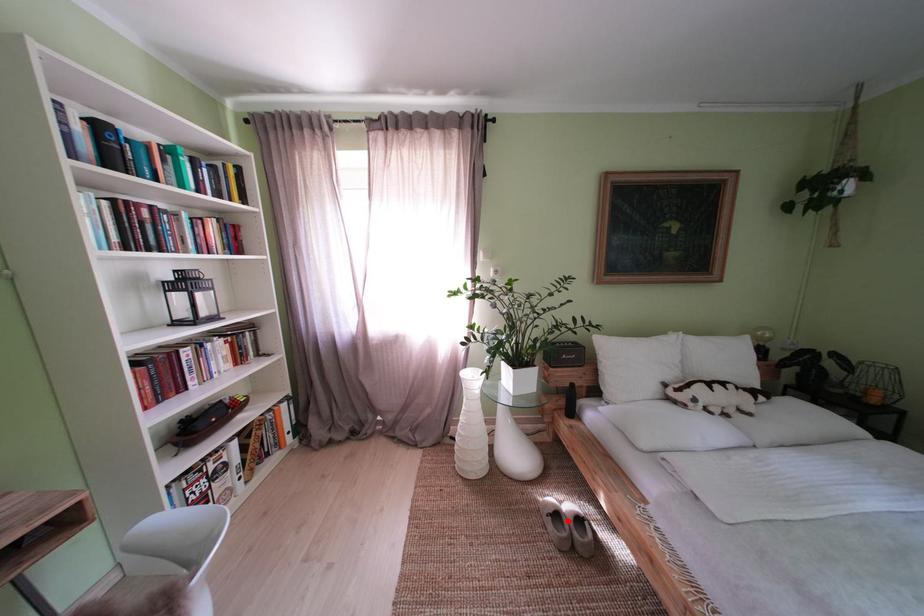
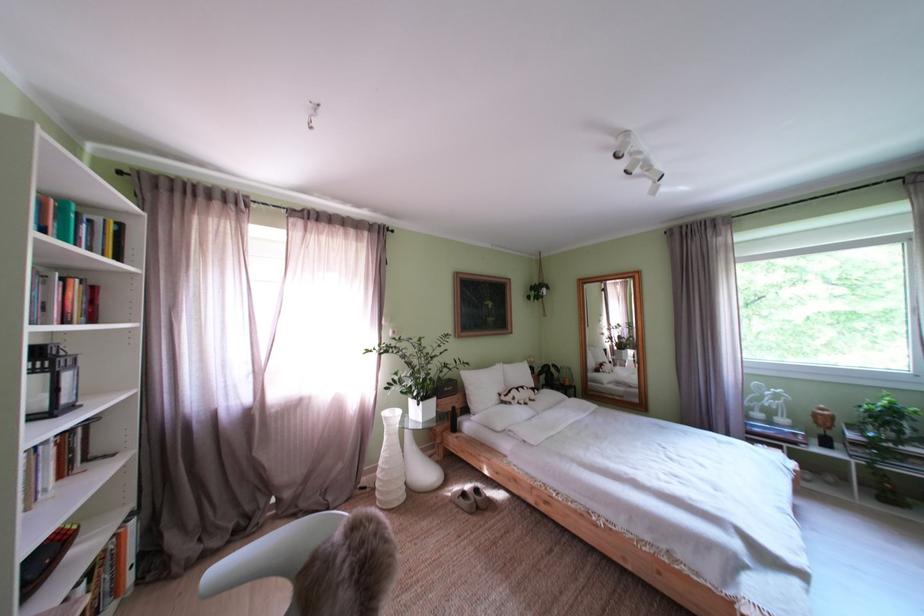
In the second image, find the point that corresponds to the highlighted location in the first image.

(475, 500)